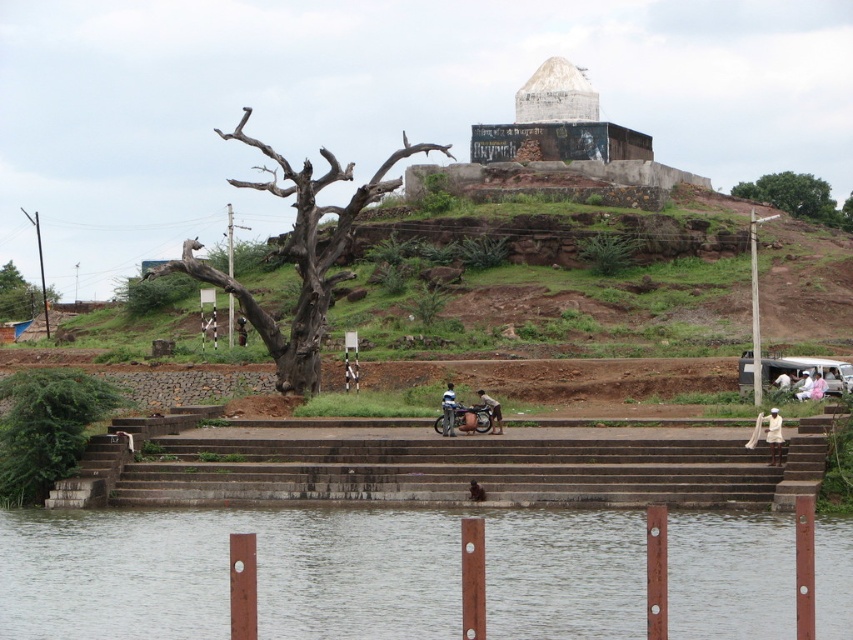
Question: Which point is farther to the camera?

Choices:
 (A) (491, 420)
 (B) (833, 200)
 (C) (151, 321)

Answer: (B)

Question: Among these points, which one is farthest from the camera?

Choices:
 (A) (776, 189)
 (B) (821, 387)
 (C) (552, 490)
 (D) (486, 397)

Answer: (A)

Question: Can you confirm if brown rough tree at left is positioned above white clothed person at lower right?

Choices:
 (A) yes
 (B) no

Answer: (A)

Question: In this image, where is brown stone stairs at center located relative to metallic blue motorcycle at center?

Choices:
 (A) below
 (B) above

Answer: (A)

Question: Among these objects, which one is farthest from the camera?

Choices:
 (A) metallic blue motorcycle at center
 (B) dead wood tree at left
 (C) brown stone stairs at center

Answer: (B)

Question: Does green leafy tree at upper right appear under blue glossy motorbike at center?

Choices:
 (A) yes
 (B) no

Answer: (B)